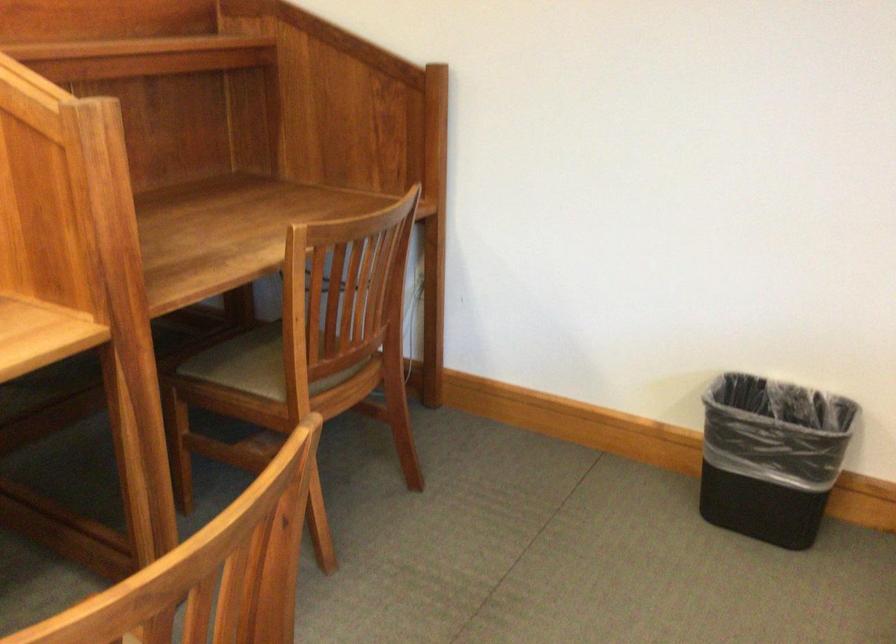
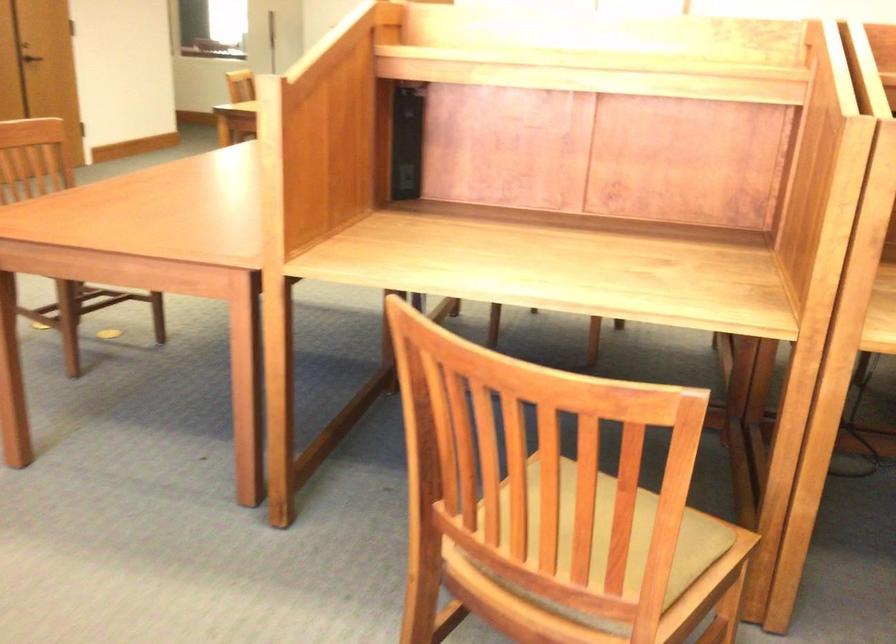
Question: The images are taken continuously from a first-person perspective. In which direction is your viewpoint rotating?

Choices:
 (A) Left
 (B) Right
 (C) Up
 (D) Down

Answer: (A)